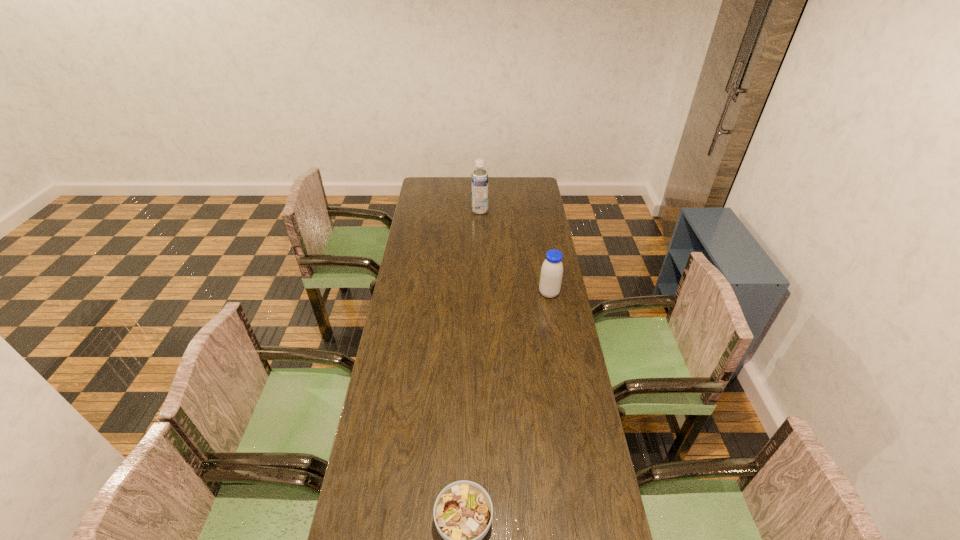
Find the location of `vacant space at the far left corner`. vacant space at the far left corner is located at coordinates click(x=429, y=188).

You are a GUI agent. You are given a task and a screenshot of the screen. Output one action in this format:
    pyautogui.click(x=<x>, y=<y>)
    Task: Click on the free space at the far right corner of the desktop
    This screenshot has height=540, width=960.
    Given the screenshot: What is the action you would take?
    pyautogui.click(x=518, y=192)

Find the location of a particular element. free spot between the farther soya milk and the second shortest object is located at coordinates (515, 252).

Where is `free space between the tallest object and the shorter soya milk`? This screenshot has height=540, width=960. free space between the tallest object and the shorter soya milk is located at coordinates (515, 252).

You are a GUI agent. You are given a task and a screenshot of the screen. Output one action in this format:
    pyautogui.click(x=<x>, y=<y>)
    Task: Click on the vacant region between the rightmost object and the taller soya milk
    This screenshot has width=960, height=540.
    Given the screenshot: What is the action you would take?
    pyautogui.click(x=515, y=252)

Identify which object is located as the nearest to the nearer soya milk. Please provide its 2D coordinates. Your answer should be formatted as a tuple, i.e. [(x, y)], where the tuple contains the x and y coordinates of a point satisfying the conditions above.

[(479, 179)]

This screenshot has height=540, width=960. What are the coordinates of `object identified as the closest to the left soya milk` in the screenshot? It's located at (551, 274).

Where is `vacant space that satisfies the following two spatial constraints: 1. on the label of the tallest object; 2. on the left side of the second shortest object`? vacant space that satisfies the following two spatial constraints: 1. on the label of the tallest object; 2. on the left side of the second shortest object is located at coordinates (480, 293).

The height and width of the screenshot is (540, 960). In order to click on free space that satisfies the following two spatial constraints: 1. on the back side of the second farthest object; 2. on the label of the farther soya milk in this screenshot , I will do `click(535, 211)`.

The height and width of the screenshot is (540, 960). I want to click on vacant area that satisfies the following two spatial constraints: 1. on the label of the taller soya milk; 2. on the left side of the rightmost object, so click(480, 293).